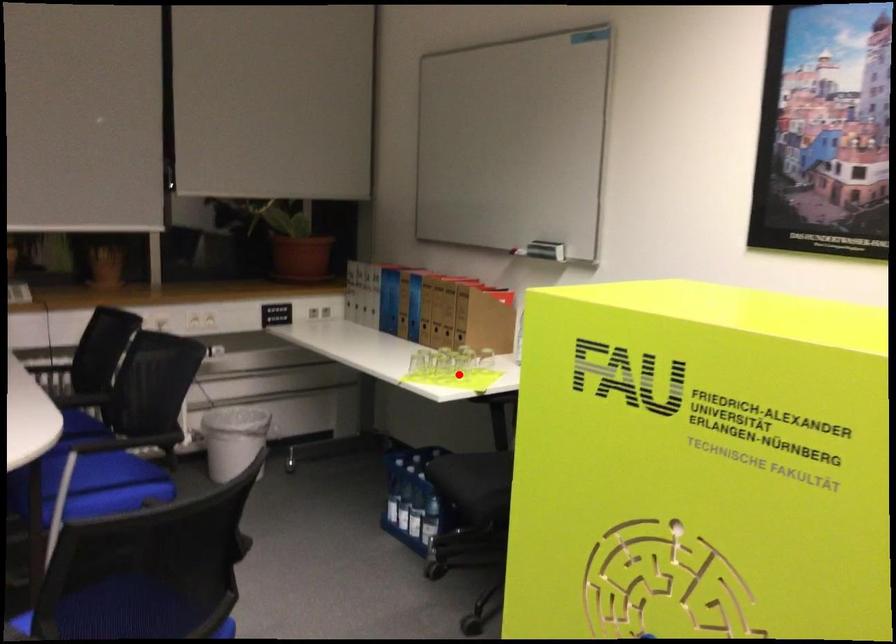
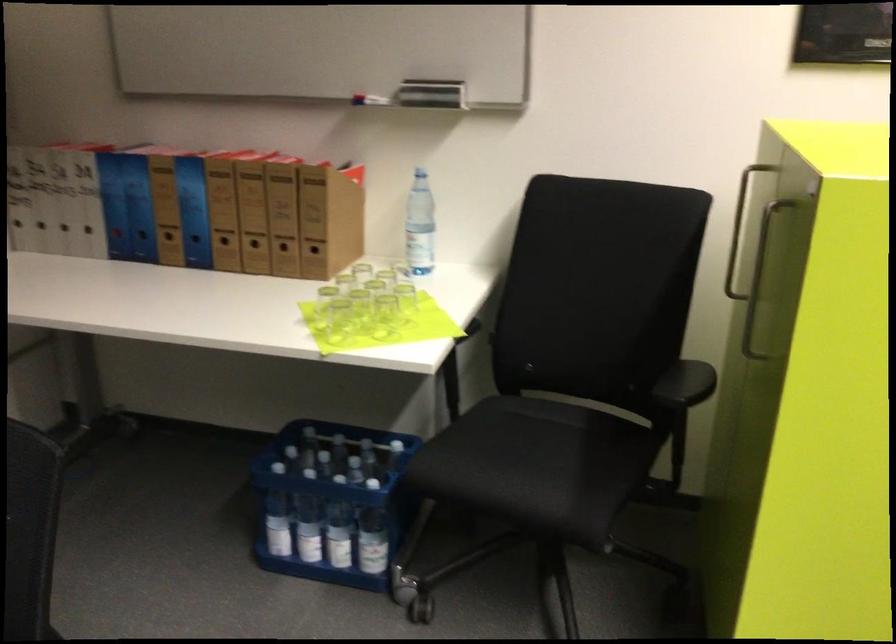
Where in the second image is the point corresponding to the highlighted location from the first image?

(383, 316)